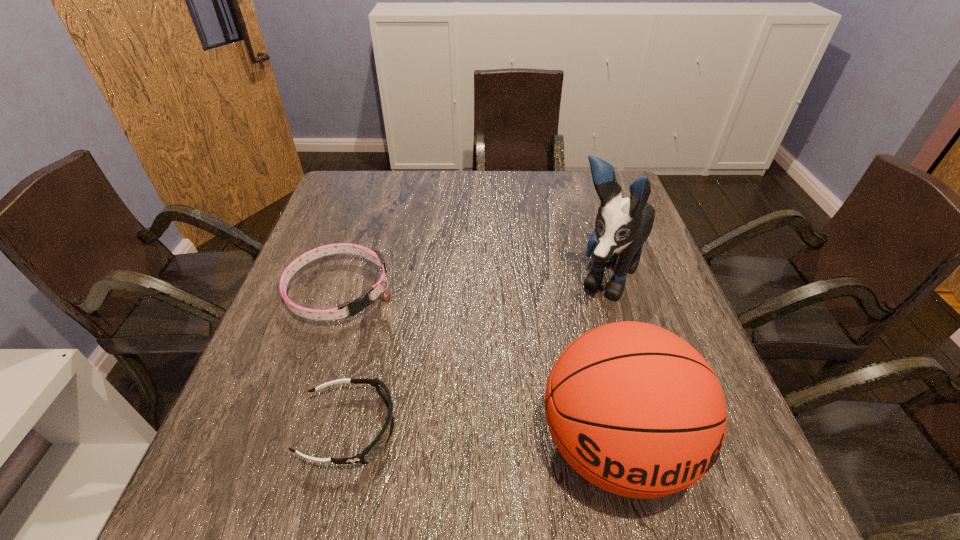
In order to click on vacant space located on the front-facing side of the puppy in this screenshot , I will do `click(556, 376)`.

Locate an element on the screen. Image resolution: width=960 pixels, height=540 pixels. goggles positioned at the near edge is located at coordinates (370, 452).

This screenshot has width=960, height=540. I want to click on basketball that is at the near edge, so (x=634, y=409).

The width and height of the screenshot is (960, 540). What are the coordinates of `goggles located at the left edge` in the screenshot? It's located at (370, 452).

Locate an element on the screen. dog collar located in the left edge section of the desktop is located at coordinates (357, 305).

Find the location of `basketball located in the right edge section of the desktop`. basketball located in the right edge section of the desktop is located at coordinates (634, 409).

Where is `puppy at the right edge`? The width and height of the screenshot is (960, 540). puppy at the right edge is located at coordinates (623, 224).

This screenshot has height=540, width=960. Identify the location of object that is at the near left corner. (370, 452).

Identify the location of object that is at the near right corner. Image resolution: width=960 pixels, height=540 pixels. click(634, 409).

Where is `vacant space at the far edge`? This screenshot has width=960, height=540. vacant space at the far edge is located at coordinates pyautogui.click(x=390, y=186).